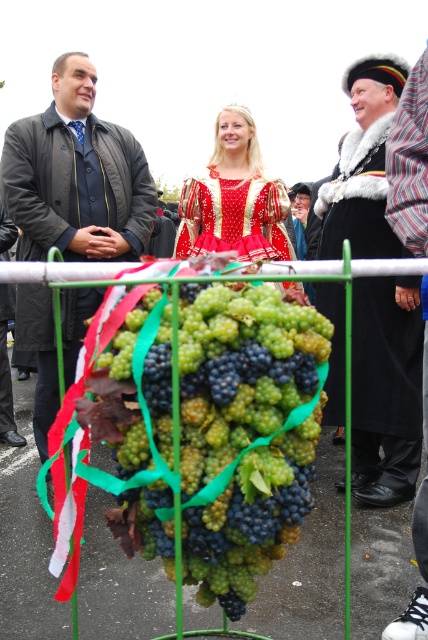
You are attending a celebration and need to locate the shiny red dress at center. According to the scene description, where exactly is the shiny red dress positioned relative to the large grape display?

The shiny red dress at center is located at point [234,198], which is to the left of the large grape display at the center of the frame.

You are a photographer setting up for a group photo. You need to ensure that both the black velvet coat at center and the matte black coat at left are visible in the frame. Based on their positions, which coat should you focus on first to ensure it doesn

The black velvet coat at center is in front of the matte black coat at left, so you should focus on the matte black coat at left first to ensure it is visible behind the black velvet coat at center.

You are attending a festival and want to take a photo with the shiny red dress at center and the striped shirt at right. If you stand in front of the grapes display, which object will appear closer to you in the photo?

The shiny red dress at center will appear closer to you in the photo because it is further to the viewer than the striped shirt at right.